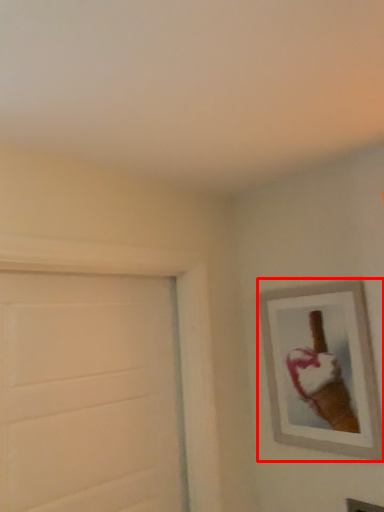
Question: In this image, where is picture frame (annotated by the red box) located relative to door?

Choices:
 (A) right
 (B) left

Answer: (A)